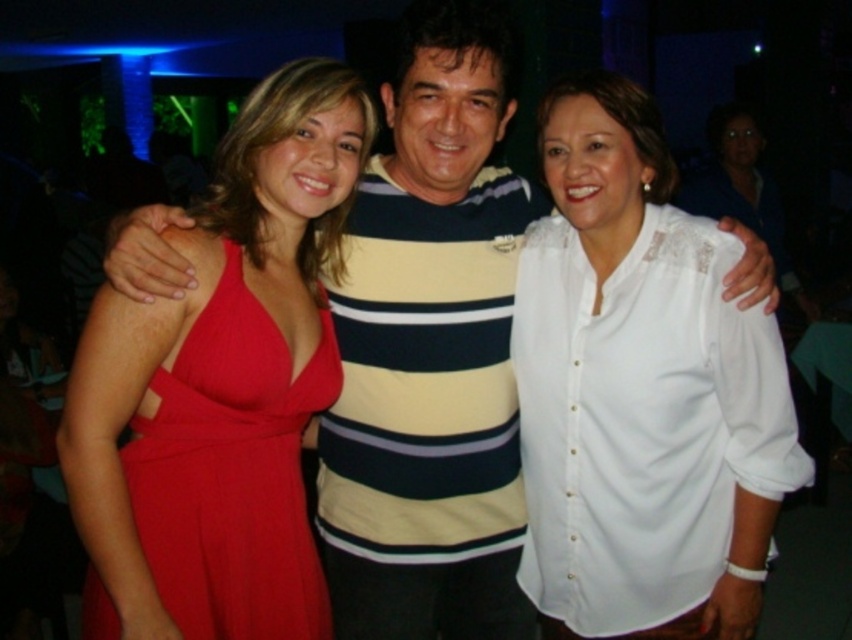
Who is more distant from viewer, (563, 154) or (163, 384)?

Positioned behind is point (563, 154).

Measure the distance between white button-down shirt at center and matte red dress at left.

white button-down shirt at center is 23.52 inches away from matte red dress at left.

Who is more distant from viewer, (x=680, y=564) or (x=269, y=486)?

The point (x=680, y=564) is behind.

Identify the location of white button-down shirt at center. The height and width of the screenshot is (640, 852). (640, 392).